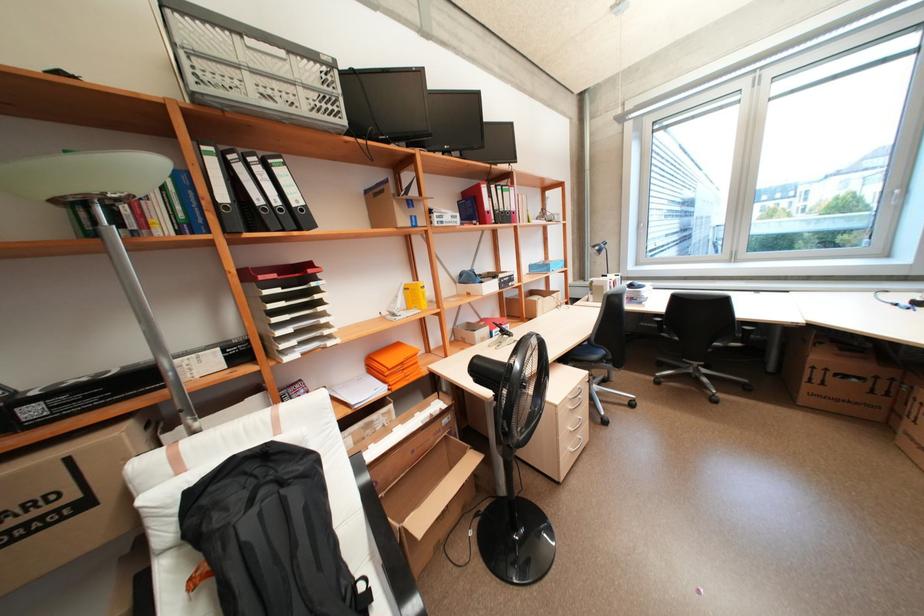
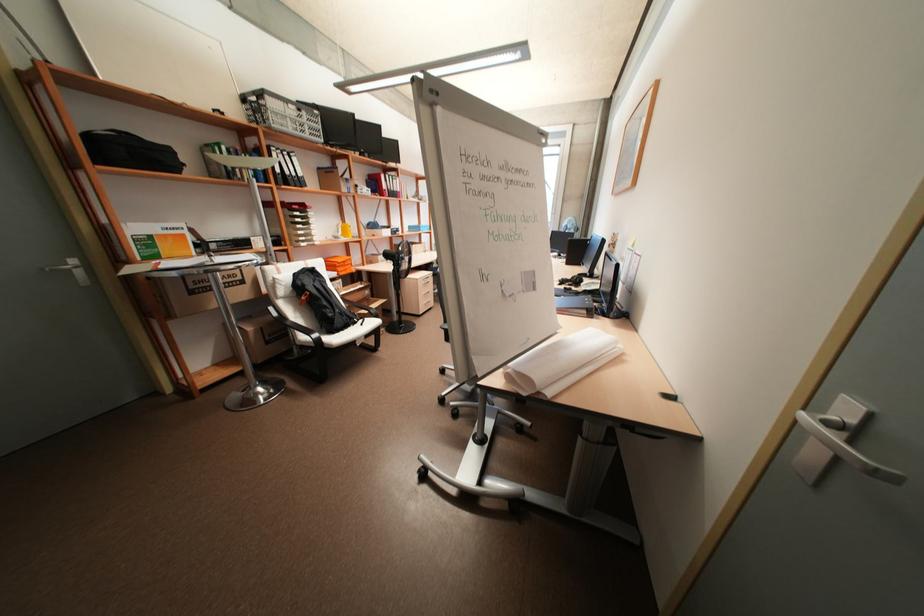
Question: I am providing you with two images of the same scene from different viewpoints. After the viewpoint changes to image2, which objects are now occluded?

Choices:
 (A) black chair armrest
 (B) silver door handle
 (C) black plastic crate
 (D) none of these

Answer: (D)